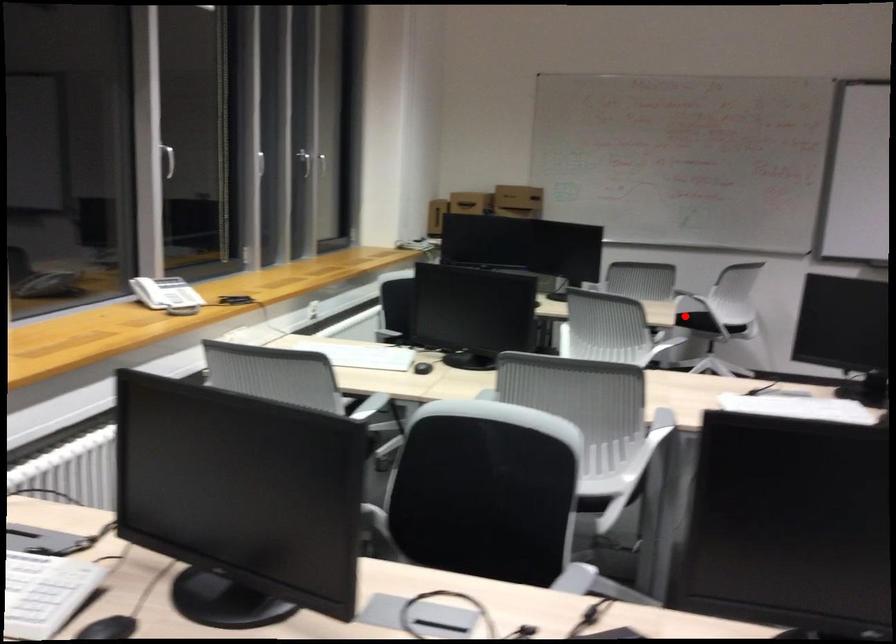
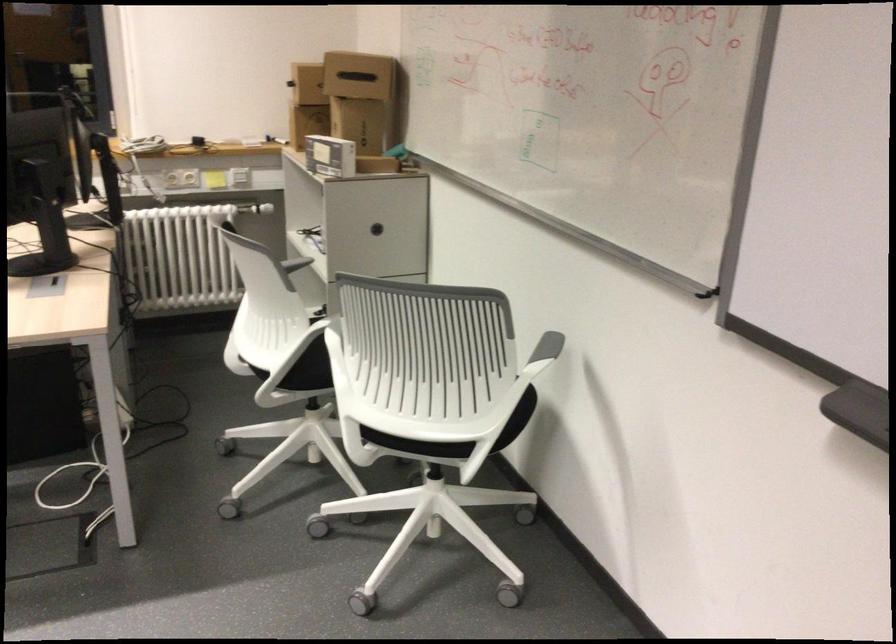
Question: I am providing you with two images of the same scene from different viewpoints. Given a red point in image1, look at the same physical point in image2. Is it:

Choices:
 (A) Closer to the viewpoint
 (B) Farther from the viewpoint

Answer: (A)